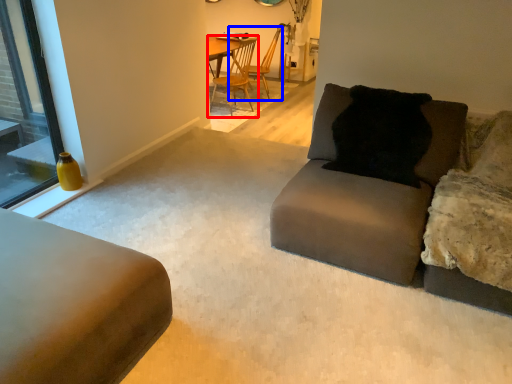
Question: Which point is further to the camera, chair (highlighted by a red box) or chair (highlighted by a blue box)?

Choices:
 (A) chair
 (B) chair

Answer: (B)